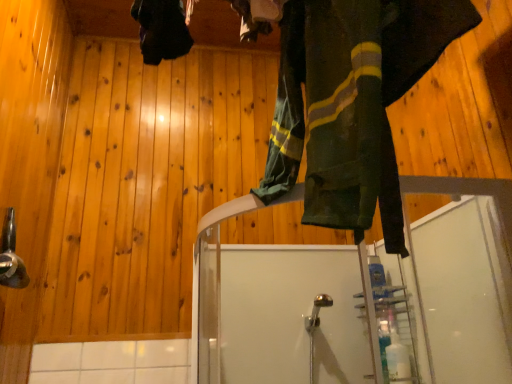
Question: Is green fabric pants at upper center completely or partially inside brushed metal shower head at left?

Choices:
 (A) no
 (B) yes

Answer: (A)

Question: Is brushed metal shower head at left positioned behind green fabric pants at upper center?

Choices:
 (A) yes
 (B) no

Answer: (A)

Question: From a real-world perspective, is brushed metal shower head at left on top of green fabric pants at upper center?

Choices:
 (A) no
 (B) yes

Answer: (A)

Question: Considering the relative sizes of brushed metal shower head at left and green fabric pants at upper center in the image provided, is brushed metal shower head at left wider than green fabric pants at upper center?

Choices:
 (A) no
 (B) yes

Answer: (A)

Question: Considering the relative positions of brushed metal shower head at left and green fabric pants at upper center in the image provided, is brushed metal shower head at left to the right of green fabric pants at upper center from the viewer's perspective?

Choices:
 (A) yes
 (B) no

Answer: (B)

Question: Is brushed metal shower head at left completely or partially outside of green fabric pants at upper center?

Choices:
 (A) no
 (B) yes

Answer: (B)

Question: Can you confirm if green fabric pants at upper center is thinner than brushed metal shower head at left?

Choices:
 (A) yes
 (B) no

Answer: (B)

Question: Is green fabric pants at upper center far away from brushed metal shower head at left?

Choices:
 (A) yes
 (B) no

Answer: (A)

Question: Would you say green fabric pants at upper center is outside brushed metal shower head at left?

Choices:
 (A) yes
 (B) no

Answer: (A)

Question: Does green fabric pants at upper center appear on the right side of brushed metal shower head at left?

Choices:
 (A) yes
 (B) no

Answer: (A)

Question: Can you confirm if green fabric pants at upper center is smaller than brushed metal shower head at left?

Choices:
 (A) no
 (B) yes

Answer: (A)

Question: From a real-world perspective, is green fabric pants at upper center below brushed metal shower head at left?

Choices:
 (A) yes
 (B) no

Answer: (B)

Question: Is green fabric pants at upper center taller or shorter than brushed metal shower head at left?

Choices:
 (A) tall
 (B) short

Answer: (A)